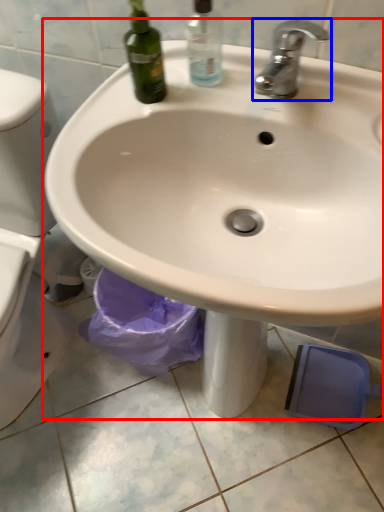
Question: Among these objects, which one is nearest to the camera, sink (highlighted by a red box) or tap (highlighted by a blue box)?

Choices:
 (A) sink
 (B) tap

Answer: (A)